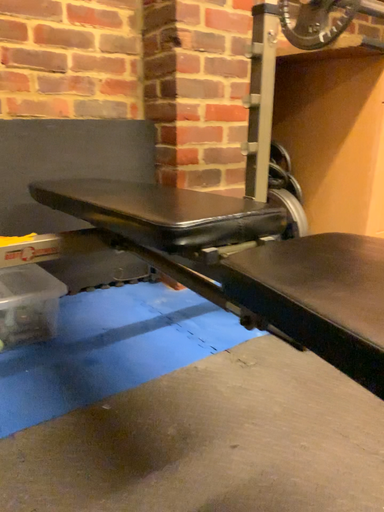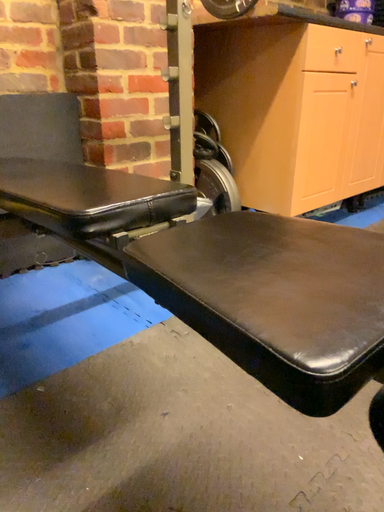
Question: How did the camera likely rotate when shooting the video?

Choices:
 (A) rotated left
 (B) rotated right

Answer: (B)